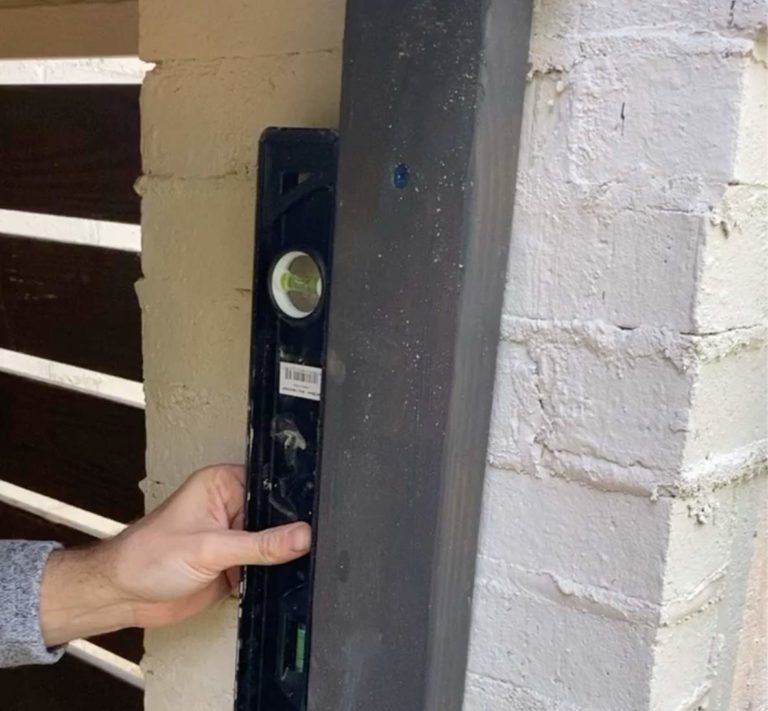
Identify the location of door frame. (421, 321).